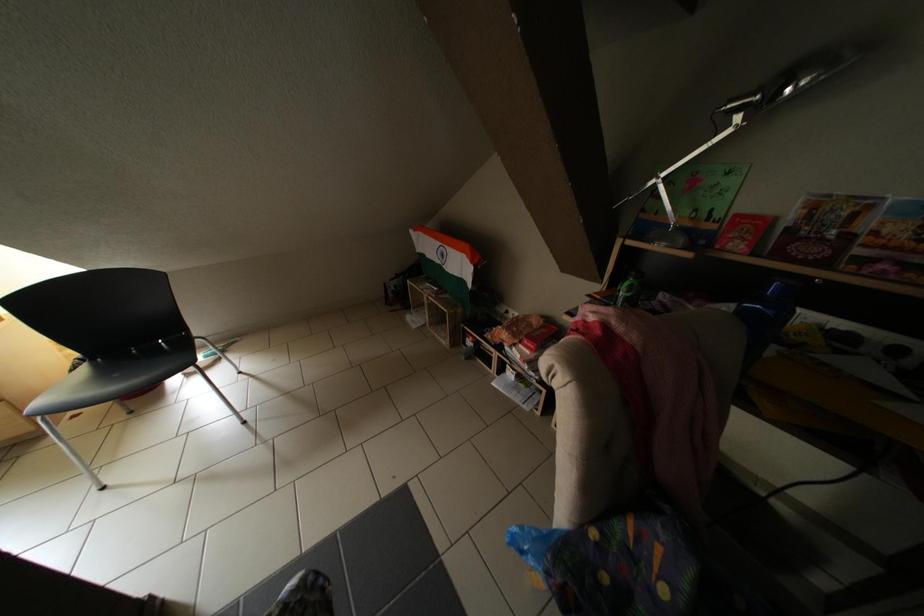
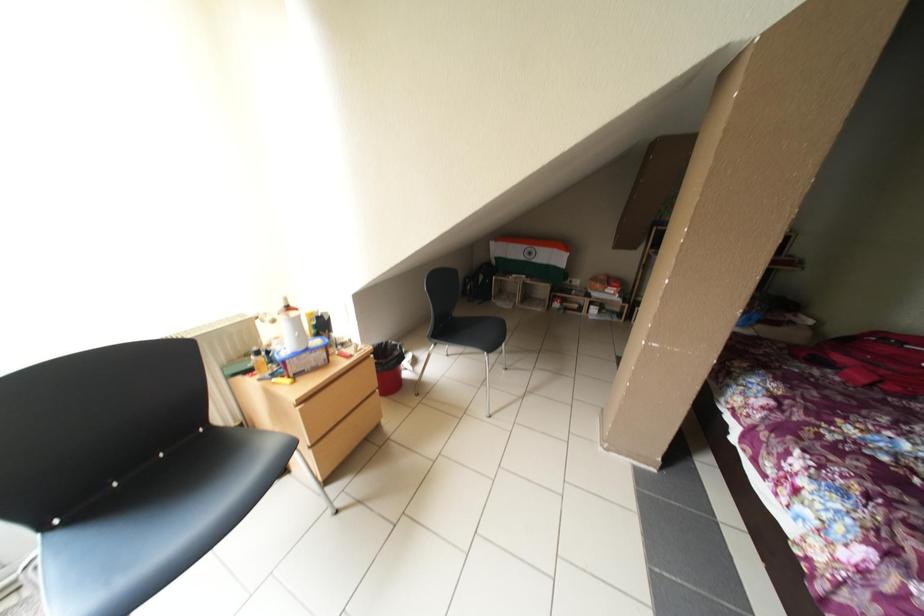
Question: In a continuous first-person perspective shot, in which direction is the camera moving?

Choices:
 (A) Left
 (B) Right
 (C) Forward
 (D) Backward

Answer: (A)